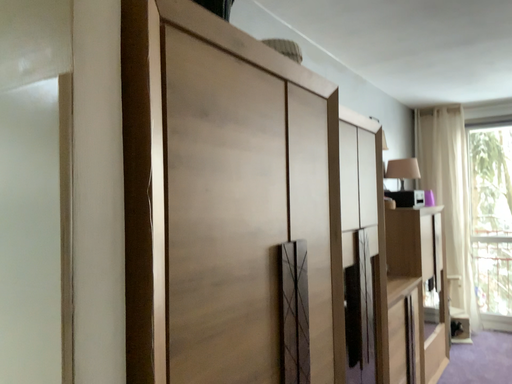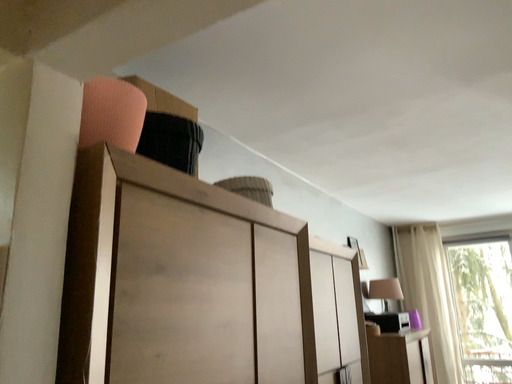
Question: How did the camera likely rotate when shooting the video?

Choices:
 (A) rotated upward
 (B) rotated downward

Answer: (A)